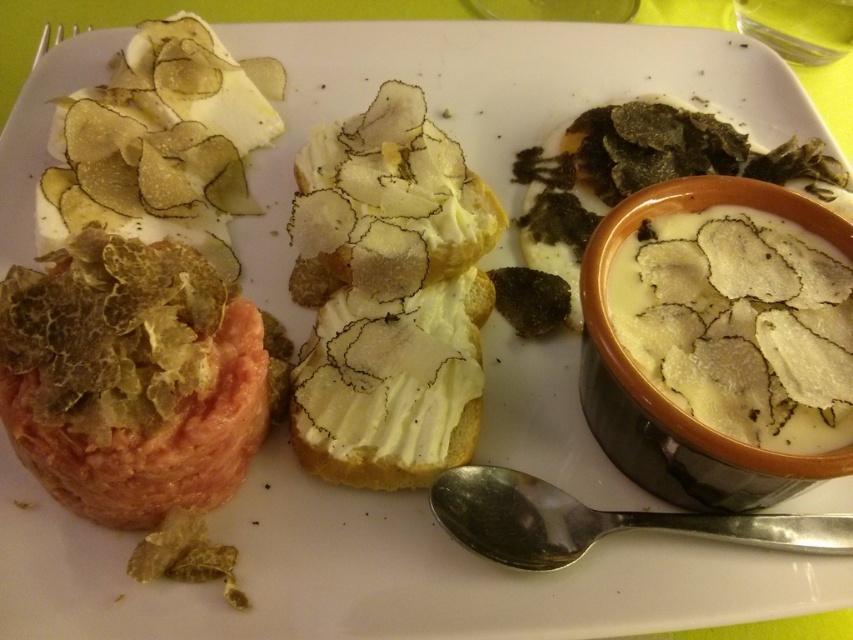
Question: Which object is farther from the camera taking this photo?

Choices:
 (A) white ceramic bowl at upper right
 (B) silver metallic spoon at lower center

Answer: (B)

Question: Is white ceramic bowl at upper right closer to the viewer compared to silver metallic spoon at lower center?

Choices:
 (A) yes
 (B) no

Answer: (A)

Question: Which object is positioned closest to the white ceramic bowl at upper right?

Choices:
 (A) black matte truffle at upper right
 (B) silver metallic spoon at lower center

Answer: (B)

Question: Which object appears farthest from the camera in this image?

Choices:
 (A) silver metallic spoon at lower center
 (B) white ceramic bowl at upper right
 (C) black matte truffle at upper right

Answer: (C)

Question: Can you confirm if white ceramic bowl at upper right is bigger than silver metallic spoon at lower center?

Choices:
 (A) no
 (B) yes

Answer: (B)

Question: Is white ceramic bowl at upper right wider than black matte truffle at upper right?

Choices:
 (A) yes
 (B) no

Answer: (B)